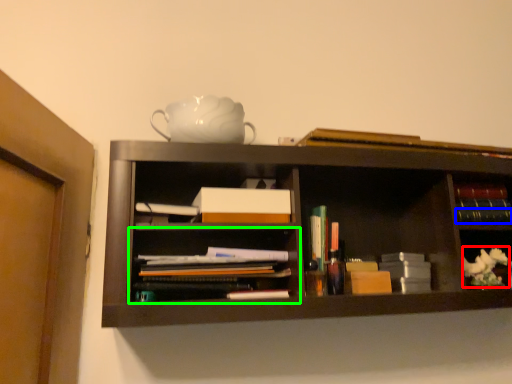
Question: Based on their relative distances, which object is farther from flower (highlighted by a red box)? Choose from book (highlighted by a blue box) and shelf (highlighted by a green box).

Choices:
 (A) book
 (B) shelf

Answer: (B)